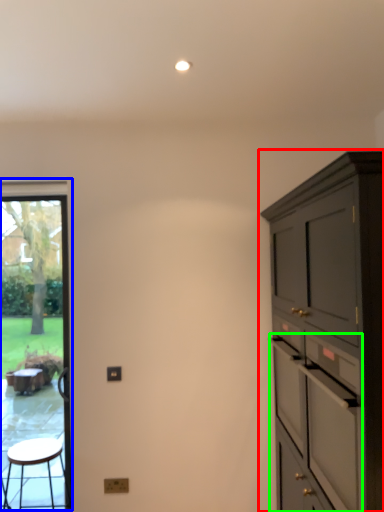
Question: Which is nearer to the cabinetry (highlighted by a red box)? window screen (highlighted by a blue box) or drawer (highlighted by a green box).

Choices:
 (A) window screen
 (B) drawer

Answer: (B)